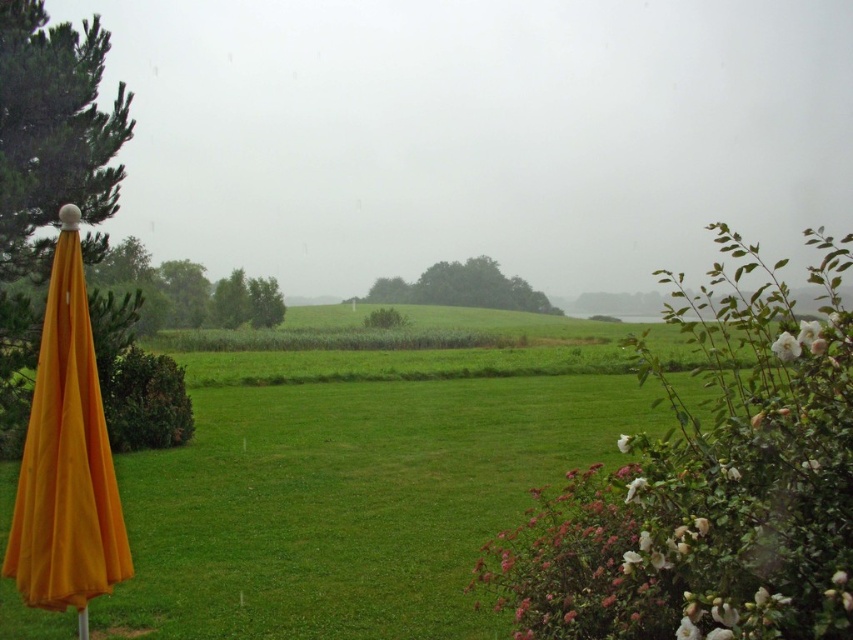
You are standing on the grassy lawn in the image and want to walk from the orange fabric umbrella at left to the white matte flower at lower right. Which direction should you move relative to the umbrella?

You should move downward from the orange fabric umbrella at left towards the white matte flower at lower right, since the umbrella is positioned above the flower in the image.

Consider the image. You are standing at the center of the lawn in the image. If you want to walk directly towards the orange fabric umbrella at left, in which direction should you move?

Since the orange fabric umbrella at left is located at point 0.717 on the x axis and 0.079 on the y axis, you should move towards the lower left direction to reach it.

You are standing at the point labeled as point (67, 458) in the image. What object are you directly facing?

The point (67, 458) indicates the orange fabric umbrella at left, so you are directly facing the orange fabric umbrella at left.